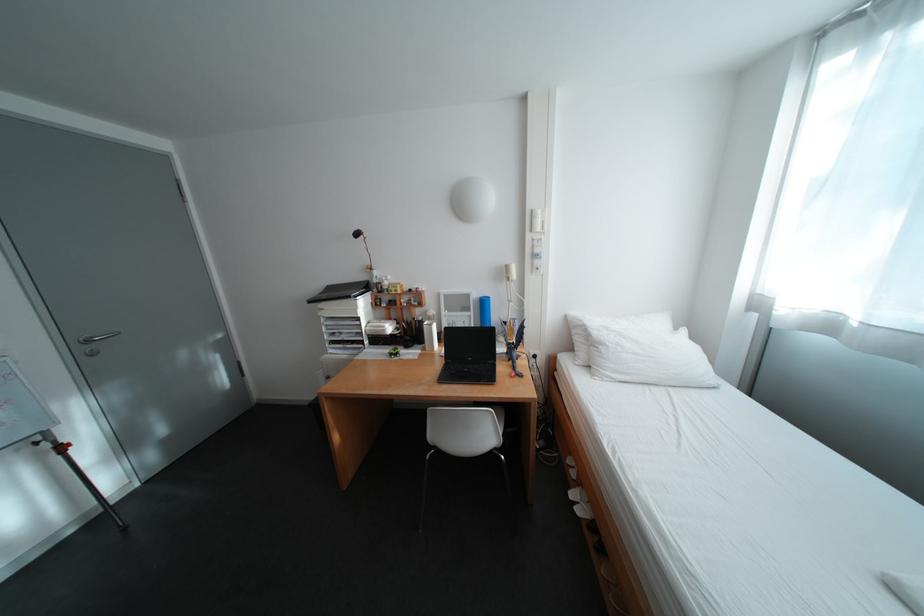
The width and height of the screenshot is (924, 616). What do you see at coordinates (513, 344) in the screenshot?
I see `the intercom handset` at bounding box center [513, 344].